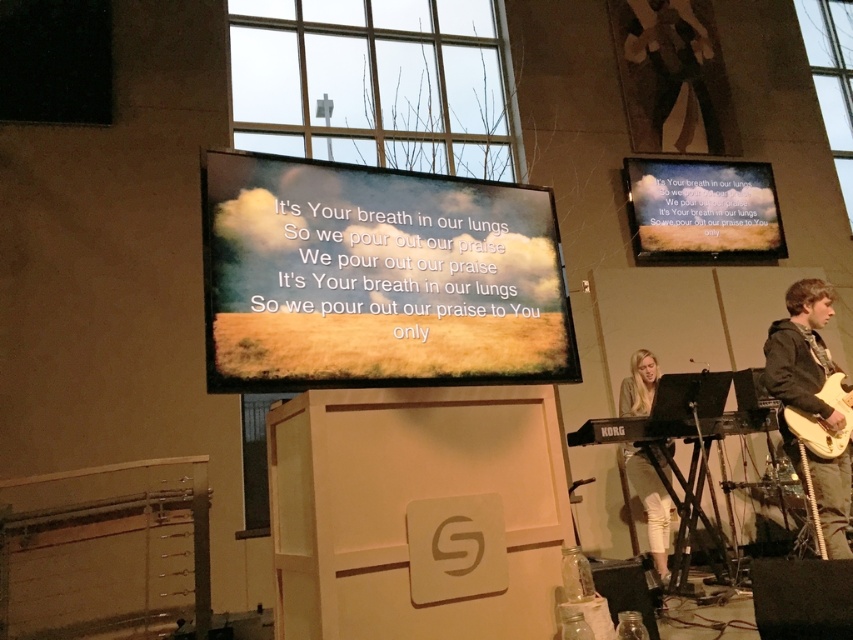
Question: Is dark gray hoodie at right further to camera compared to light wood electric guitar at right?

Choices:
 (A) no
 (B) yes

Answer: (A)

Question: From the image, what is the correct spatial relationship of matte black projection screen at upper right in relation to light wood electric guitar at right?

Choices:
 (A) right
 (B) left

Answer: (A)

Question: Which point is closer to the camera taking this photo?

Choices:
 (A) (840, 397)
 (B) (642, 451)
 (C) (555, 225)
 (D) (781, 241)

Answer: (C)

Question: Among these points, which one is nearest to the camera?

Choices:
 (A) pos(647,378)
 (B) pos(641,253)
 (C) pos(370,280)
 (D) pos(824,394)

Answer: (C)

Question: Among these points, which one is nearest to the camera?

Choices:
 (A) (795, 416)
 (B) (849, 472)
 (C) (437, 356)

Answer: (C)

Question: Does matte glass projection screen at center appear under matte black projection screen at upper right?

Choices:
 (A) yes
 (B) no

Answer: (A)